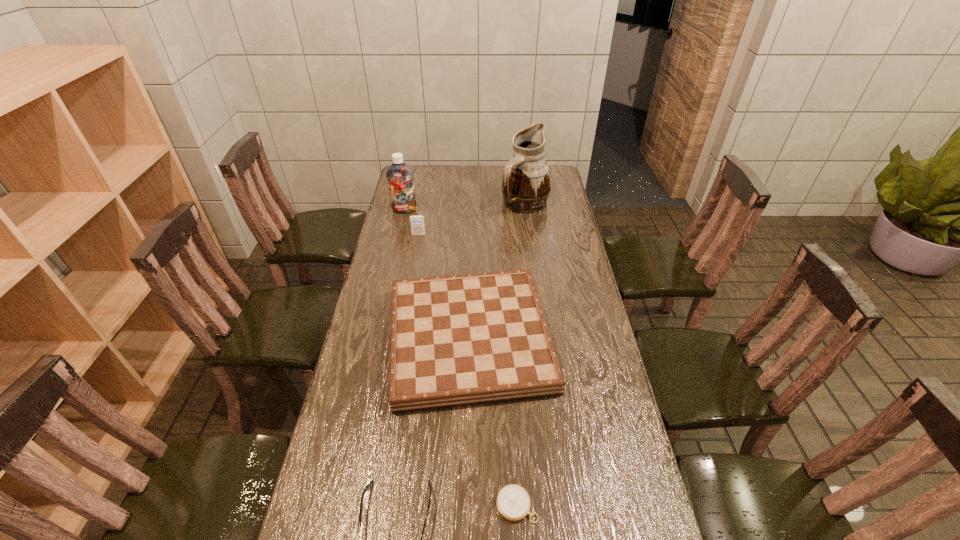
At what (x,y) coordinates should I click in order to perform the action: click on pitcher. Please return your answer as a coordinate pair (x, y). The height and width of the screenshot is (540, 960). Looking at the image, I should click on (526, 186).

Find the location of a particular element. the second tallest object is located at coordinates (399, 175).

You are a GUI agent. You are given a task and a screenshot of the screen. Output one action in this format:
    pyautogui.click(x=<x>, y=<y>)
    Task: Click on the third farthest object
    
    Given the screenshot: What is the action you would take?
    pyautogui.click(x=417, y=221)

This screenshot has width=960, height=540. Find the location of `iPod`. iPod is located at coordinates (417, 221).

At what (x,y) coordinates should I click in order to perform the action: click on the fourth shortest object. Please return your answer as a coordinate pair (x, y). The height and width of the screenshot is (540, 960). Looking at the image, I should click on (459, 340).

Identify the location of gameboard. The image size is (960, 540). (459, 340).

The image size is (960, 540). Find the location of `compass`. compass is located at coordinates (513, 503).

I want to click on free space located 0.370m from the spout of the tallest object, so click(x=535, y=274).

This screenshot has height=540, width=960. In order to click on free location located on the front label of the shampoo in this screenshot , I will do (392, 264).

Identify the location of vacant space situated on the front-facing side of the iPod. Image resolution: width=960 pixels, height=540 pixels. (409, 291).